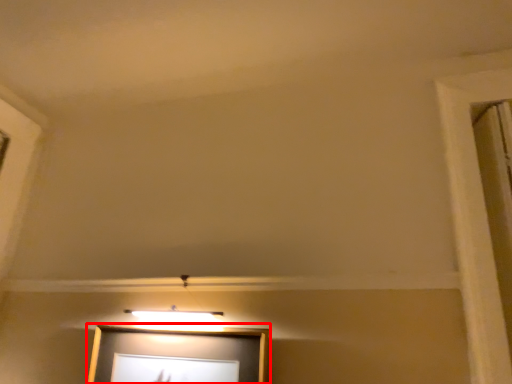
Question: From the image's perspective, where is picture frame (annotated by the red box) located in relation to window frame in the image?

Choices:
 (A) above
 (B) below

Answer: (B)